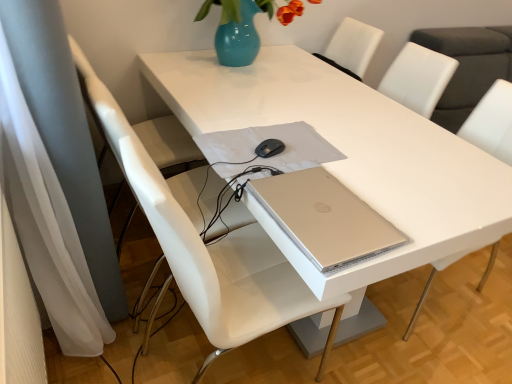
Locate an element on the screen. This screenshot has width=512, height=384. vacant location below white leather chair at center, the first chair viewed from the left (from a real-world perspective) is located at coordinates (160, 293).